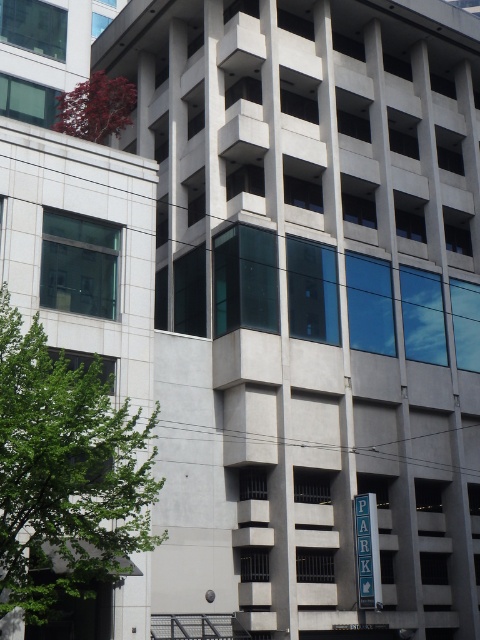
Question: Does green leafy tree at left have a lesser width compared to red matte tree at upper left?

Choices:
 (A) yes
 (B) no

Answer: (B)

Question: Which point appears farthest from the camera in this image?

Choices:
 (A) (81, 88)
 (B) (381, 593)

Answer: (A)

Question: Which point is farther to the camera?

Choices:
 (A) (110, 106)
 (B) (370, 525)
 (C) (85, 410)

Answer: (A)

Question: Estimate the real-world distances between objects in this image. Which object is farther from the blue metal parking sign at center?

Choices:
 (A) red matte tree at upper left
 (B) green leafy tree at left

Answer: (A)

Question: Is green leafy tree at left to the left of red matte tree at upper left from the viewer's perspective?

Choices:
 (A) no
 (B) yes

Answer: (A)

Question: Can you confirm if green leafy tree at left is wider than blue metal parking sign at center?

Choices:
 (A) yes
 (B) no

Answer: (A)